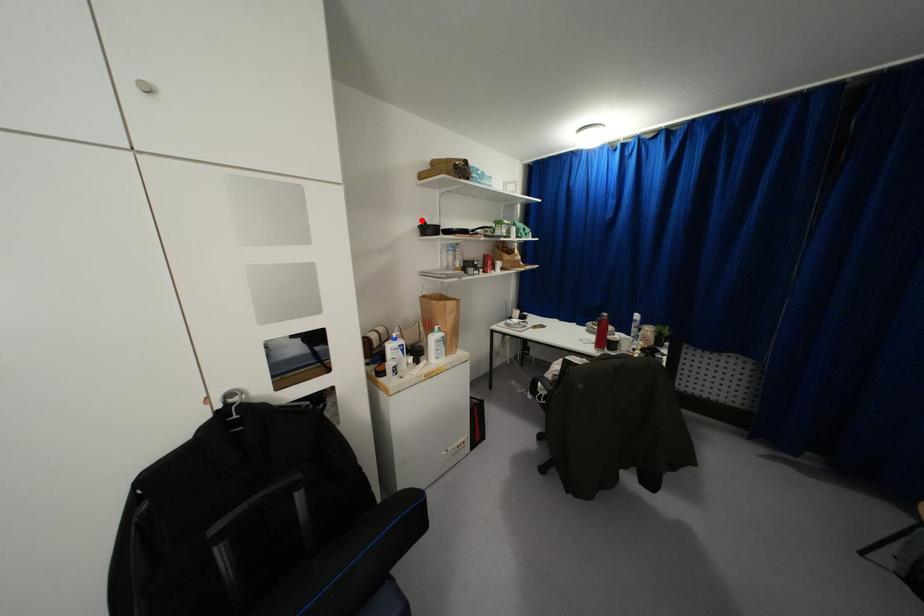
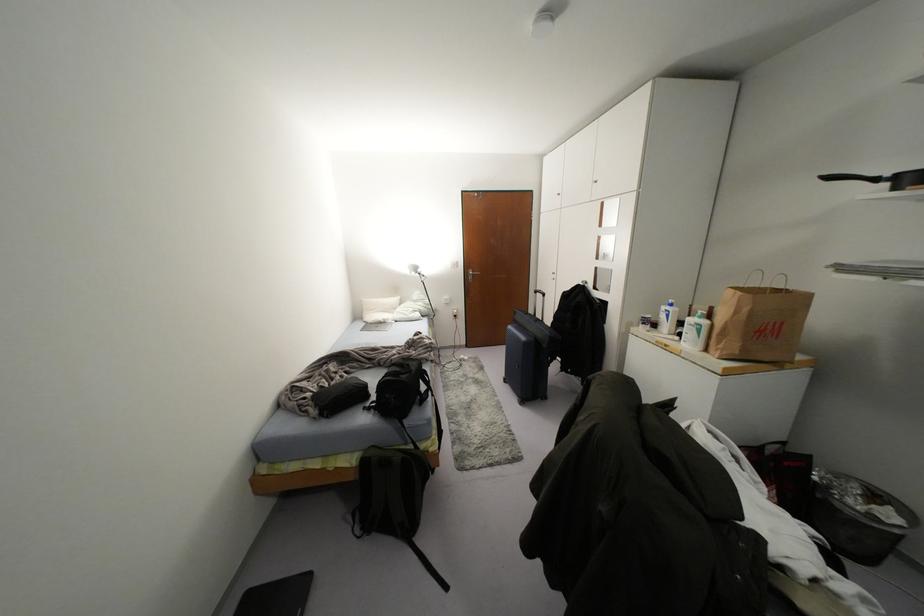
Where in the second image is the point corresponding to the highlighted location from the first image?

(829, 177)